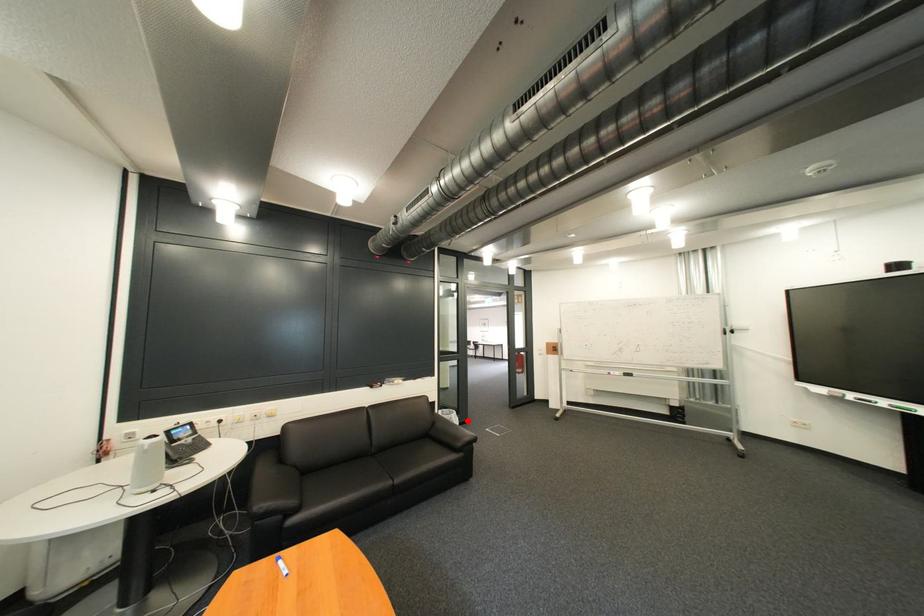
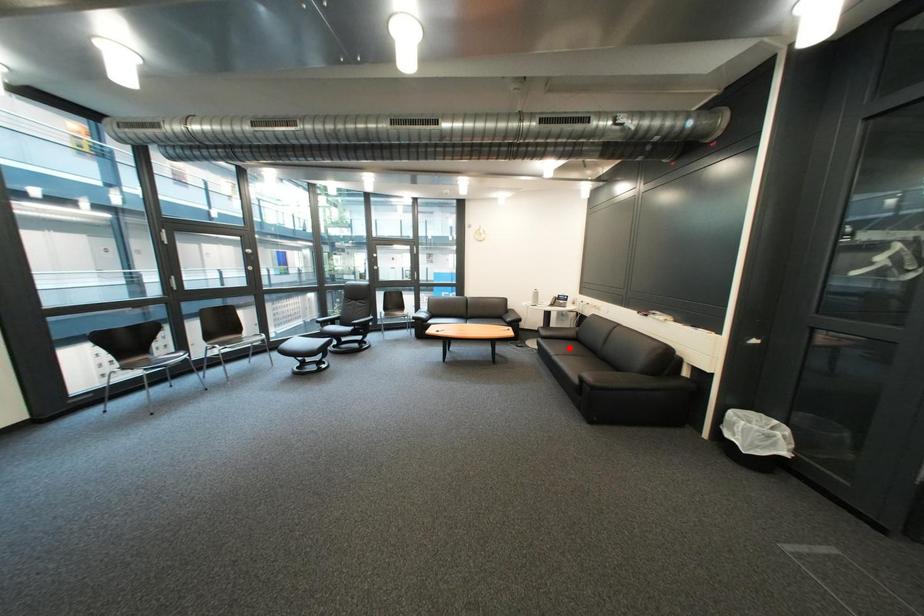
I am providing you with two images of the same scene from different viewpoints. A red point is marked on the first image and another point is marked on the second image. Is the red point in image1 aligned with the point shown in image2?

No